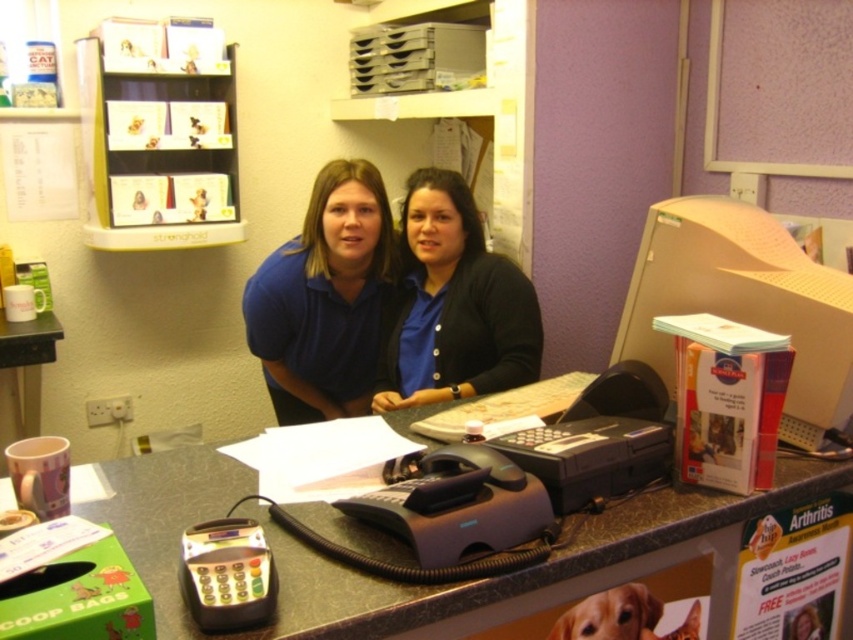
Who is lower down, marble countertop at center or blue matte shirt at center?

marble countertop at center is below.

Based on the photo, can you confirm if marble countertop at center is positioned to the left of blue matte shirt at center?

Incorrect, marble countertop at center is not on the left side of blue matte shirt at center.

Which is in front, point (585, 529) or point (341, 412)?

Point (585, 529) is more forward.

The image size is (853, 640). I want to click on marble countertop at center, so click(x=383, y=580).

Can you confirm if blue matte shirt at center is wider than black matte cardigan at center?

Indeed, blue matte shirt at center has a greater width compared to black matte cardigan at center.

Which is in front, point (363, 412) or point (381, 392)?

Point (381, 392) is more forward.

Is point (329, 257) positioned after point (428, 272)?

That is True.

Where is `blue matte shirt at center`? blue matte shirt at center is located at coordinates (323, 298).

Between marble countertop at center and black matte cardigan at center, which one is positioned lower?

marble countertop at center

Can you confirm if marble countertop at center is thinner than black matte cardigan at center?

Incorrect, marble countertop at center's width is not less than black matte cardigan at center's.

This screenshot has height=640, width=853. What do you see at coordinates (383, 580) in the screenshot?
I see `marble countertop at center` at bounding box center [383, 580].

I want to click on marble countertop at center, so click(383, 580).